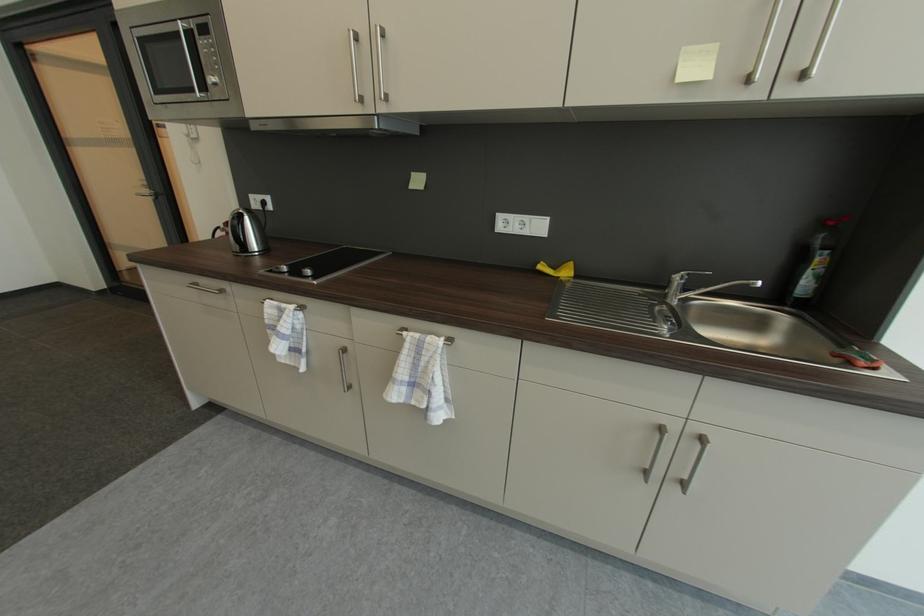
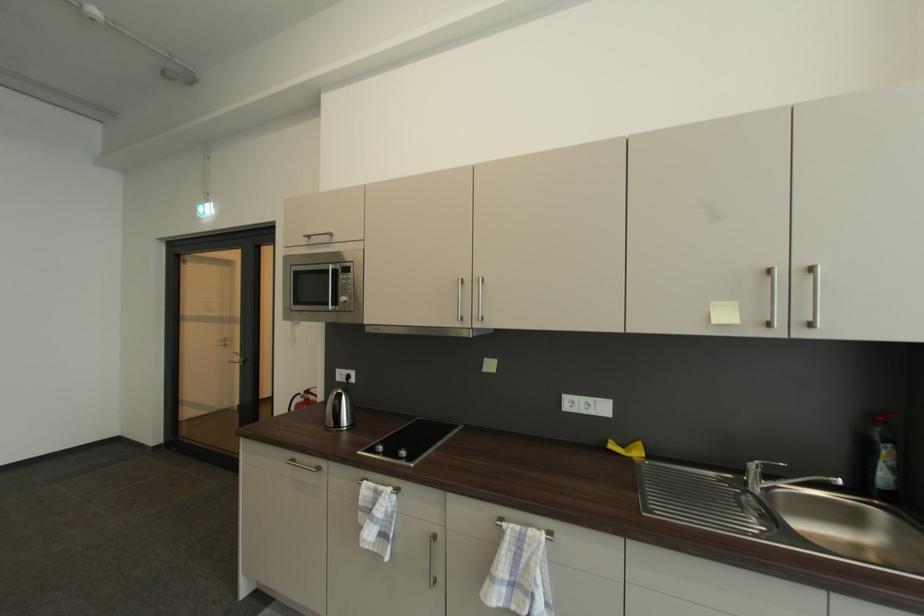
Where in the second image is the point corresponding to point (200, 91) from the first image?

(334, 306)